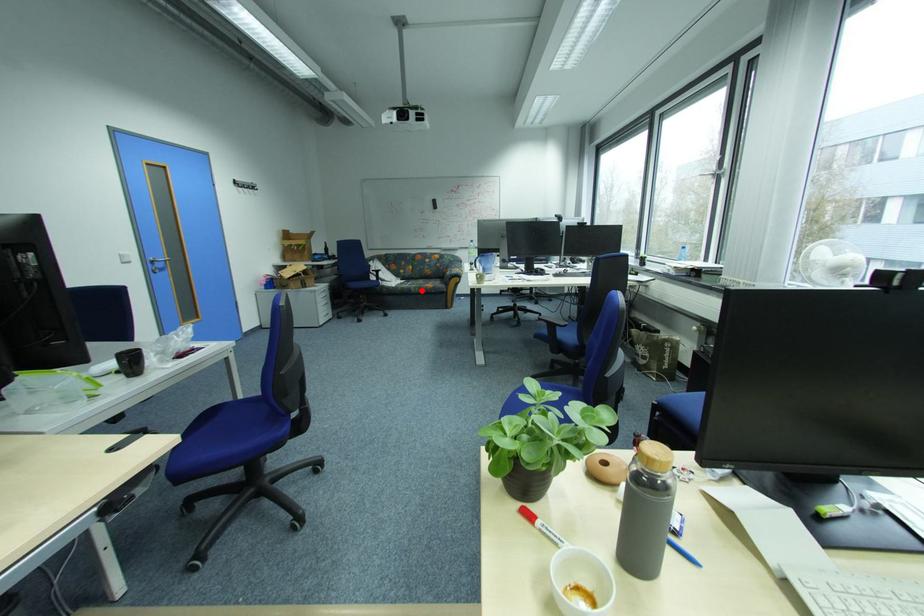
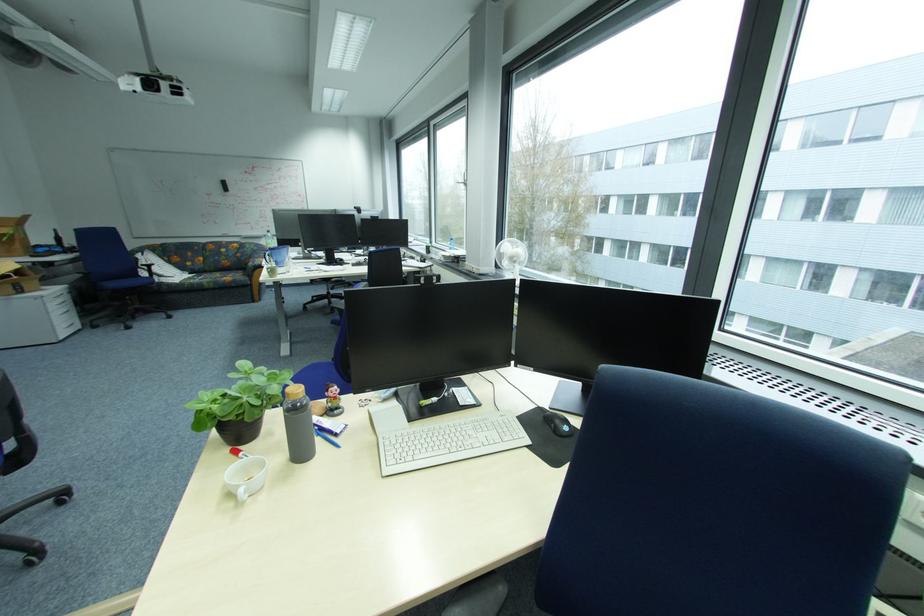
Question: A red point is marked in image1. In image2, is the corresponding 3D point closer to the camera or farther? Reply with the corresponding letter.

Choices:
 (A) The corresponding 3D point is closer.
 (B) The corresponding 3D point is farther.

Answer: (A)